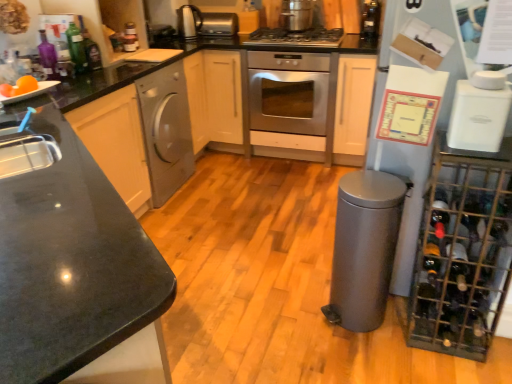
The width and height of the screenshot is (512, 384). I want to click on free space above satin silver trash can at lower right, the first appliance in the right-to-left sequence (from a real-world perspective), so click(x=365, y=184).